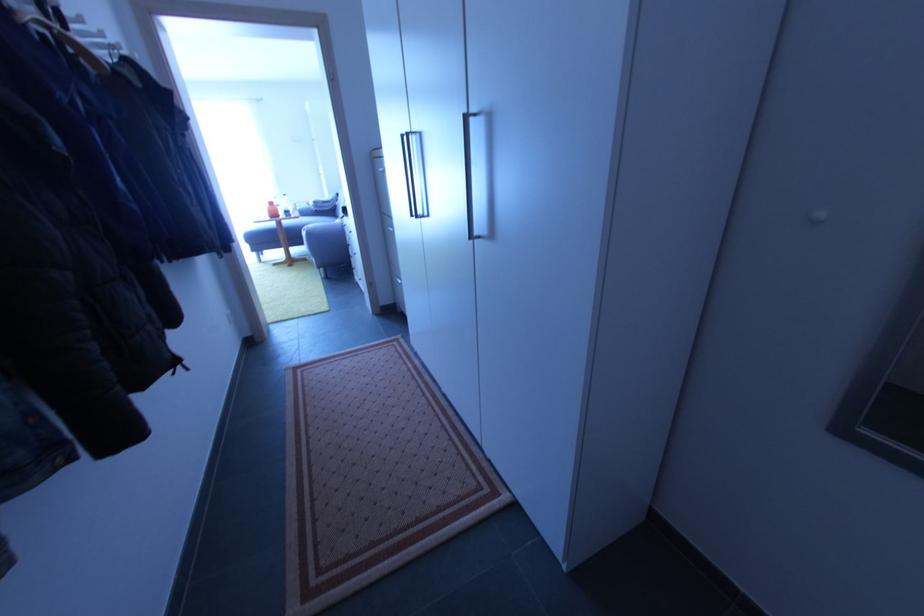
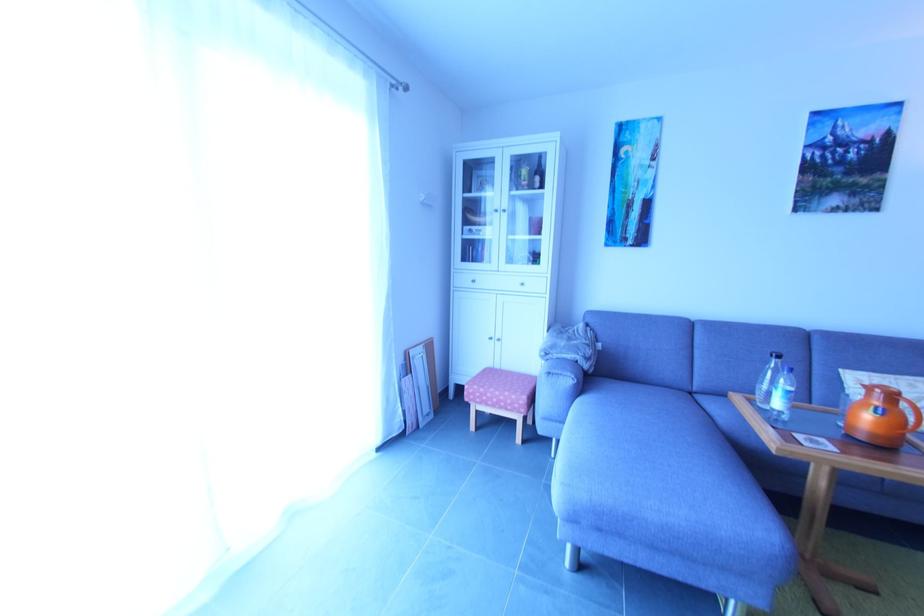
Where in the second image is the point corresponding to point 298,209 from the first image?

(406, 362)